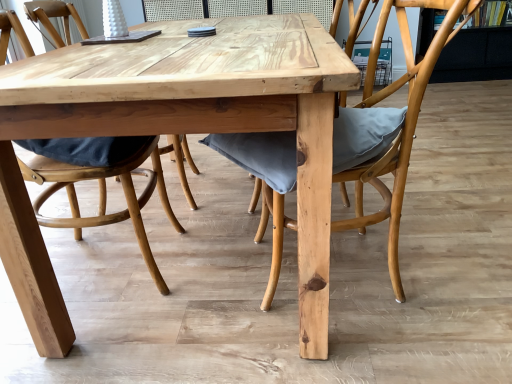
You are a GUI agent. You are given a task and a screenshot of the screen. Output one action in this format:
    pyautogui.click(x=<x>, y=<y>)
    Task: Click on the empty space that is to the right of matte gray cushion at center, the second chair viewed from the left
    The width and height of the screenshot is (512, 384).
    Given the screenshot: What is the action you would take?
    pyautogui.click(x=460, y=239)